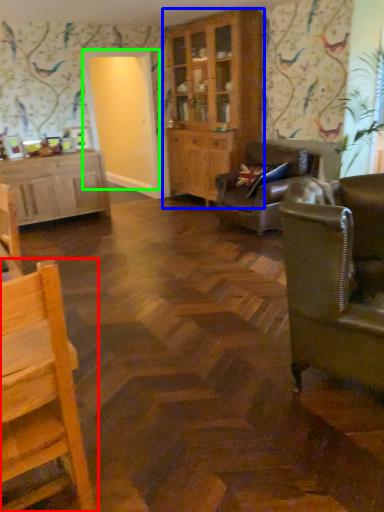
Question: Which object is the closest to the chair (highlighted by a red box)? Choose among these: cabinetry (highlighted by a blue box) or glass door (highlighted by a green box).

Choices:
 (A) cabinetry
 (B) glass door

Answer: (A)